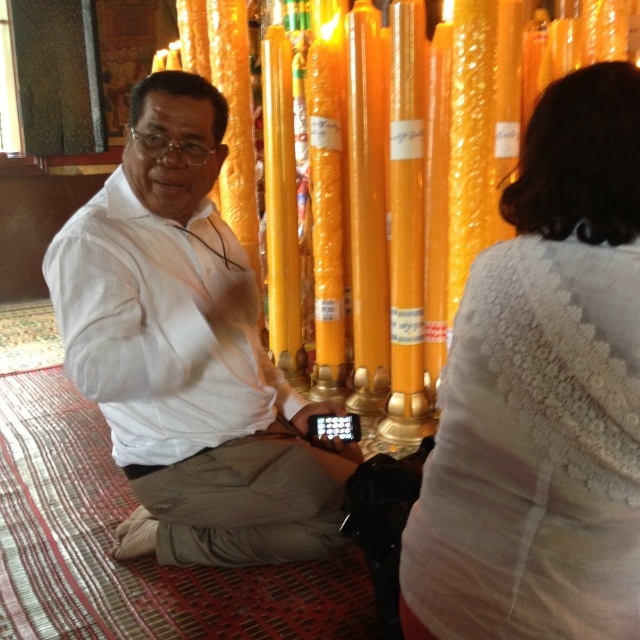
You are standing at the entrance of the temple and see two points marked in the image. The first point is at coordinates point (611,484) and the second is at point (314,490). Which point is closer to you?

Point (611,484) is in front of point (314,490), so it is closer to you.

You are an interior designer analyzing the temple layout. The white lace sweater at upper right is part of the decor. Where exactly is it placed in the image?

The white lace sweater at upper right is placed at the 2D coordinates point (541, 396) in the image.